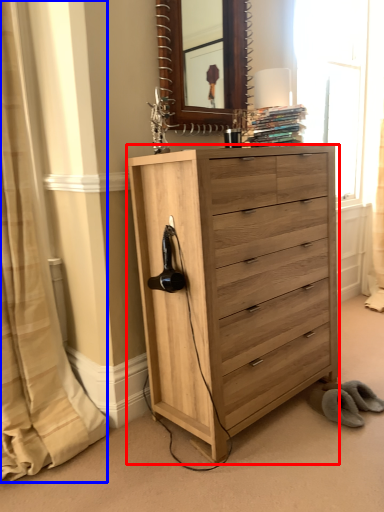
Question: Among these objects, which one is nearest to the camera, chest of drawers (highlighted by a red box) or curtain (highlighted by a blue box)?

Choices:
 (A) chest of drawers
 (B) curtain

Answer: (B)